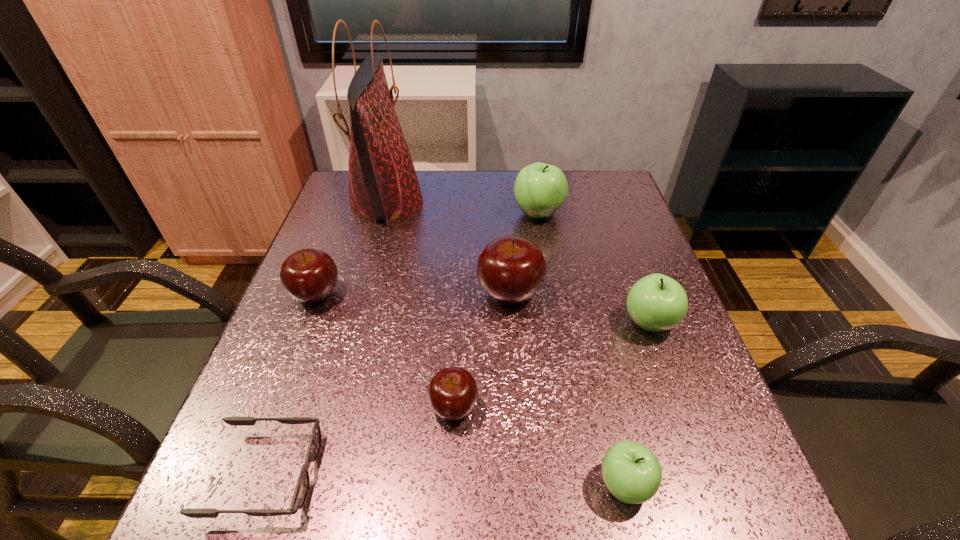
Image resolution: width=960 pixels, height=540 pixels. Identify the location of empty space between the tallest object and the biggest red apple. (448, 248).

Locate an element on the screen. The image size is (960, 540). empty space that is in between the biggest red apple and the shortest object is located at coordinates coord(388,383).

Where is `vacant region between the shortest object and the biggest green apple`? This screenshot has width=960, height=540. vacant region between the shortest object and the biggest green apple is located at coordinates (402, 343).

Identify the location of free space between the nearest red apple and the second smallest red apple. The width and height of the screenshot is (960, 540). (385, 351).

Locate an element on the screen. The width and height of the screenshot is (960, 540). vacant space in between the nearest green apple and the biggest red apple is located at coordinates (567, 389).

Where is `object that is the third closest to the nearest apple`? object that is the third closest to the nearest apple is located at coordinates (510, 269).

Identify which object is the fourth nearest to the tallest object. Please provide its 2D coordinates. Your answer should be formatted as a tuple, i.e. [(x, y)], where the tuple contains the x and y coordinates of a point satisfying the conditions above.

[(452, 393)]

Identify which apple is the third nearest to the leftmost red apple. Please provide its 2D coordinates. Your answer should be formatted as a tuple, i.e. [(x, y)], where the tuple contains the x and y coordinates of a point satisfying the conditions above.

[(540, 189)]

Locate an element on the screen. the fifth closest apple relative to the biggest red apple is located at coordinates (632, 473).

Identify the location of green apple that is the third nearest to the leftmost red apple. (656, 302).